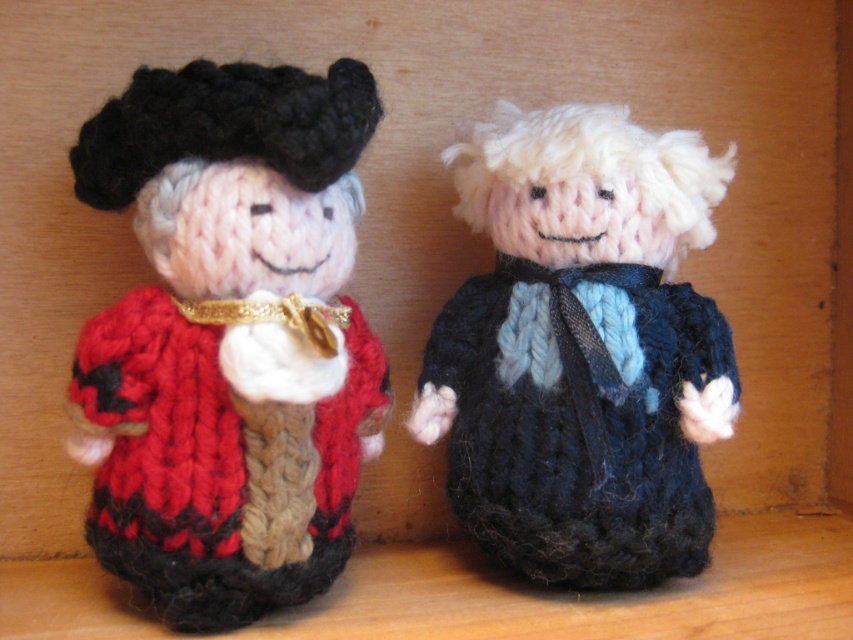
Can you confirm if knitted red sweater at left is positioned above knitted blue sweater at center?

Yes, knitted red sweater at left is above knitted blue sweater at center.

Does point (219, 525) lie in front of point (518, 371)?

Yes, point (219, 525) is closer to viewer.

In the scene shown: Who is more forward, [314,422] or [637,492]?

Point [314,422]

Where is `knitted red sweater at left`? The image size is (853, 640). knitted red sweater at left is located at coordinates (229, 337).

Between point (263, 556) and point (712, 314), which one is positioned behind?

Positioned behind is point (712, 314).

Is point (465, 524) closer to viewer compared to point (503, 220)?

No, (465, 524) is behind (503, 220).

This screenshot has height=640, width=853. In order to click on knitted woolen doll at center in this screenshot , I will do `click(230, 337)`.

Can you confirm if knitted woolen doll at center is positioned to the right of knitted red sweater at left?

Indeed, knitted woolen doll at center is positioned on the right side of knitted red sweater at left.

Which is behind, point (302, 413) or point (374, 387)?

Positioned behind is point (374, 387).

Which is behind, point (254, 182) or point (294, 561)?

Point (294, 561)

Image resolution: width=853 pixels, height=640 pixels. What are the coordinates of `knitted woolen doll at center` in the screenshot? It's located at (230, 337).